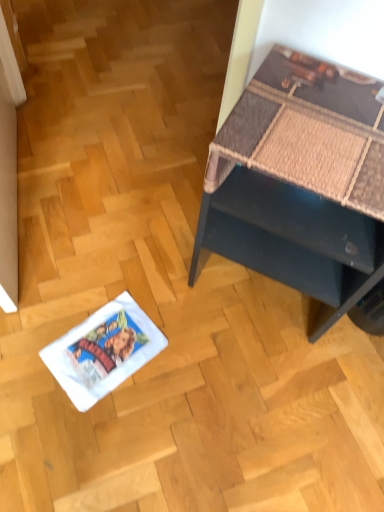
Question: From the image's perspective, is white paper comic book at lower left located above or below dark blue textured desk at upper right?

Choices:
 (A) above
 (B) below

Answer: (B)

Question: Looking at their shapes, would you say white paper comic book at lower left is wider or thinner than dark blue textured desk at upper right?

Choices:
 (A) wide
 (B) thin

Answer: (B)

Question: Is white paper comic book at lower left taller or shorter than dark blue textured desk at upper right?

Choices:
 (A) short
 (B) tall

Answer: (A)

Question: Is dark blue textured desk at upper right inside the boundaries of white paper comic book at lower left, or outside?

Choices:
 (A) inside
 (B) outside

Answer: (B)

Question: From the image's perspective, is dark blue textured desk at upper right located above or below white paper comic book at lower left?

Choices:
 (A) below
 (B) above

Answer: (B)

Question: In the image, is dark blue textured desk at upper right positioned in front of or behind white paper comic book at lower left?

Choices:
 (A) behind
 (B) front

Answer: (B)

Question: From a real-world perspective, is dark blue textured desk at upper right positioned above or below white paper comic book at lower left?

Choices:
 (A) below
 (B) above

Answer: (B)